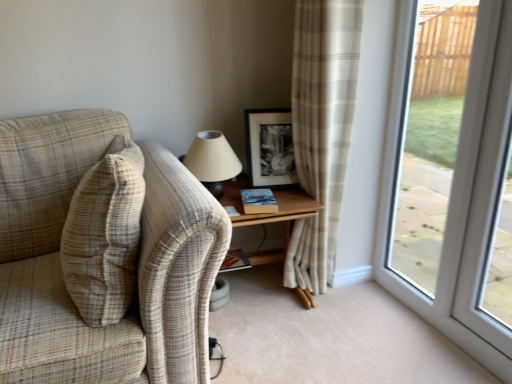
The height and width of the screenshot is (384, 512). Identify the location of vacant space in wooden table at center (from a real-world perspective). (261, 294).